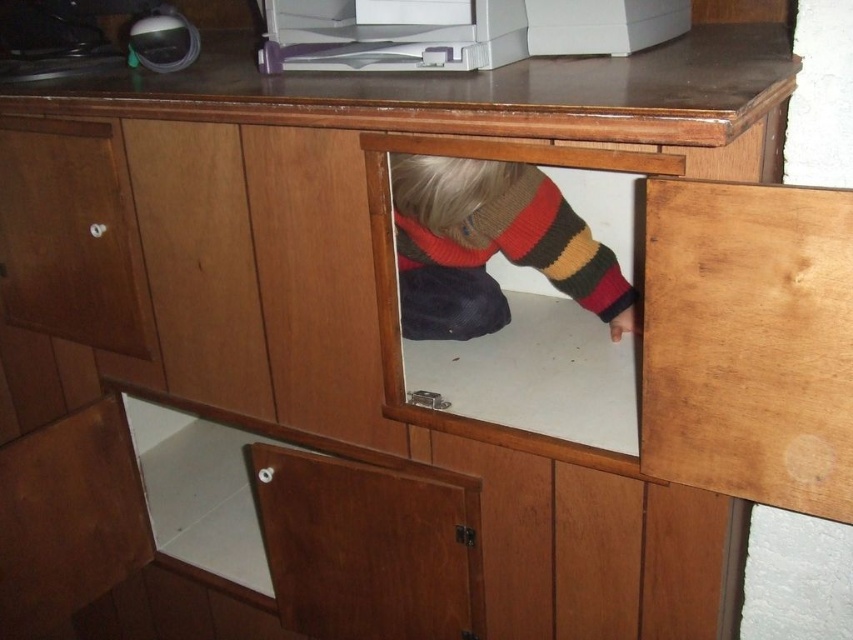
You are standing 1 meter away from the wooden cabinet. A point at coordinates (x=22, y=134) is located on the cabinet. Can you reach this point without moving closer to the cabinet?

The distance of point (x=22, y=134) from viewer is 1.11 meters, so you are currently 1 meter away. Since the point is 1.11 meters away, you need to move 0.11 meters closer to reach it.

You need to place a small item into the matte wood drawer at left and the knitted sweater at center. Which one is closer to the left side of the cabinet?

The matte wood drawer at left is closer to the left side of the cabinet than the knitted sweater at center.

You are standing in front of the wooden cabinet and want to place a new item on the knitted sweater at center. Based on the coordinates given, where exactly should you place the item?

Answer: The knitted sweater at center is located at coordinates point (491, 244), so you should place the new item at that exact position.